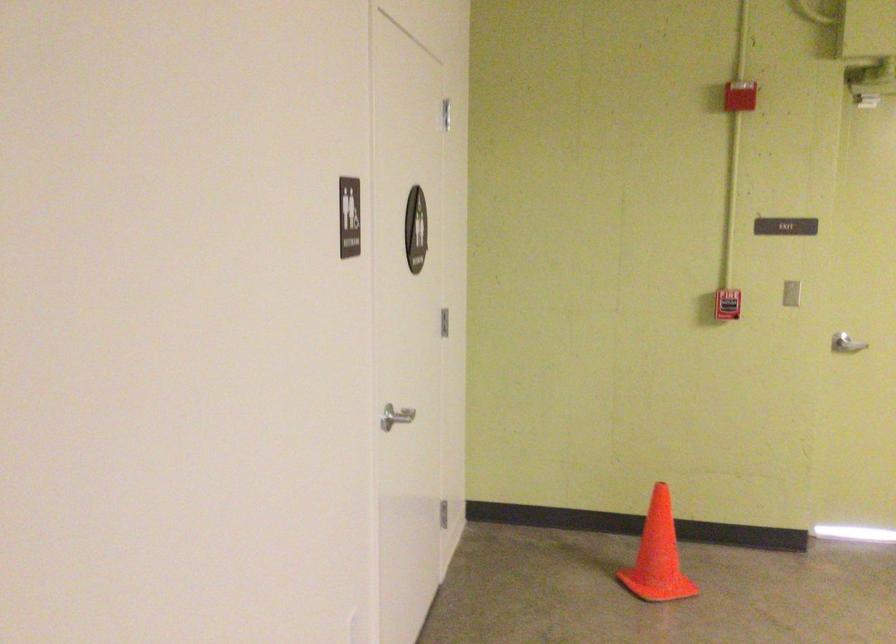
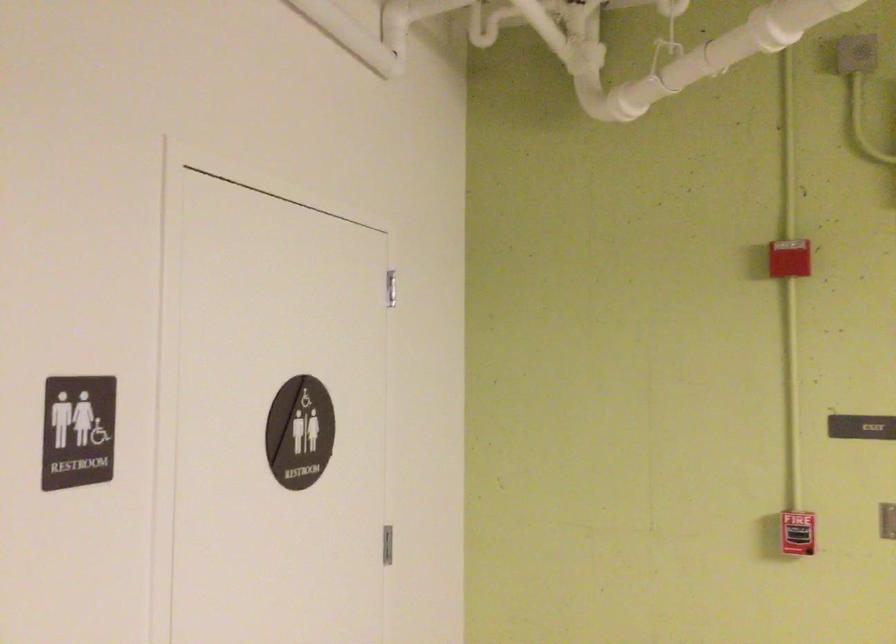
Which direction would the cameraman need to move to produce the second image?

The movement direction of the cameraman is right, forward.